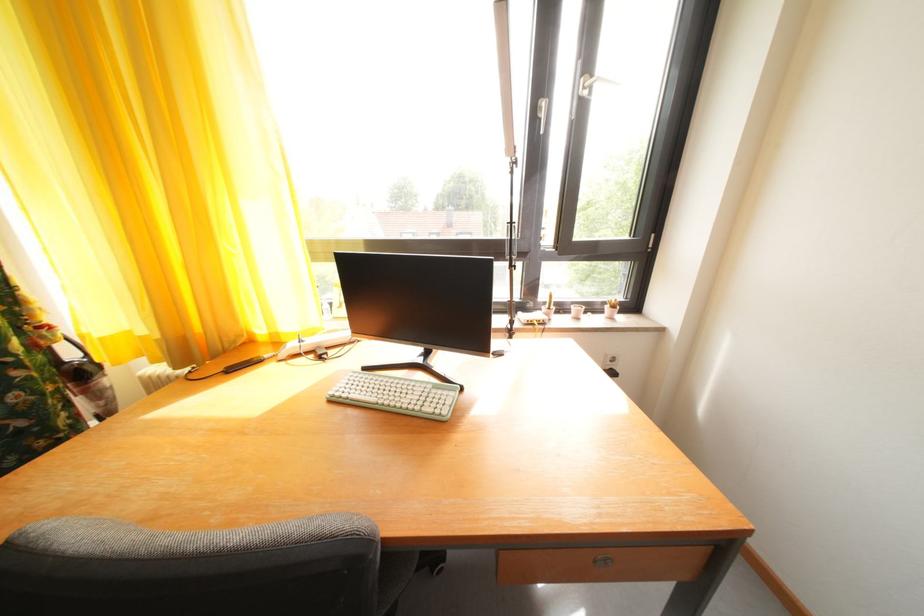
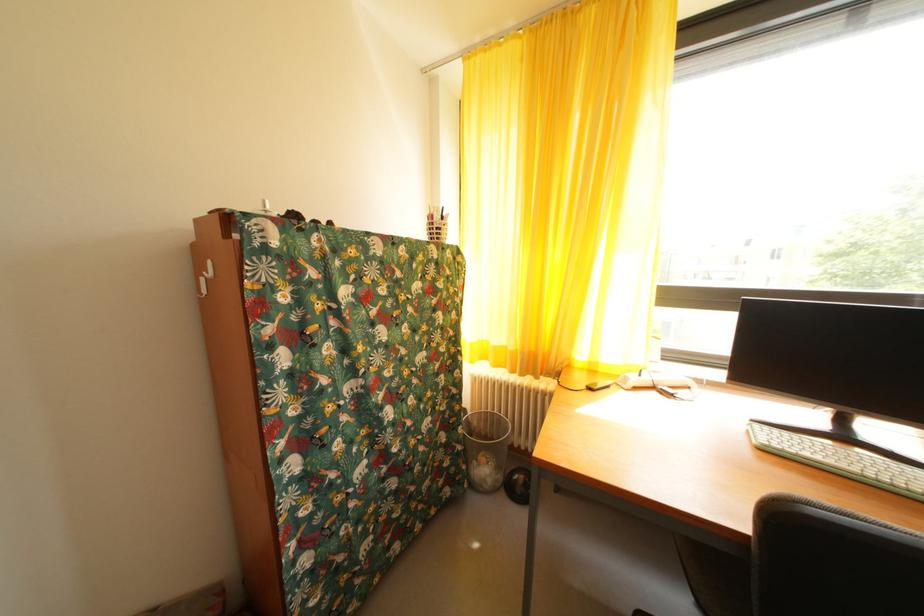
Question: How did the camera likely rotate?

Choices:
 (A) Left
 (B) Right
 (C) Up
 (D) Down

Answer: (A)